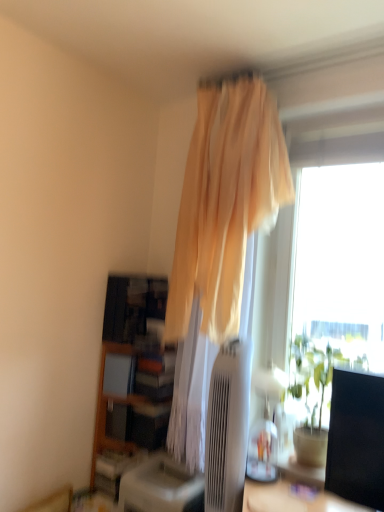
Question: In terms of size, does green leafy plant at right appear bigger or smaller than wooden bookshelf at lower left?

Choices:
 (A) big
 (B) small

Answer: (B)

Question: In the image, is green leafy plant at right on the left side or the right side of wooden bookshelf at lower left?

Choices:
 (A) left
 (B) right

Answer: (B)

Question: Estimate the real-world distances between objects in this image. Which object is closer to the green leafy plant at right?

Choices:
 (A) beige sheer curtain at upper center
 (B) wooden bookshelf at lower left
 (C) satin beige air conditioner at center

Answer: (C)

Question: Which of these objects is positioned farthest from the green leafy plant at right?

Choices:
 (A) satin beige air conditioner at center
 (B) beige sheer curtain at upper center
 (C) wooden bookshelf at lower left

Answer: (C)